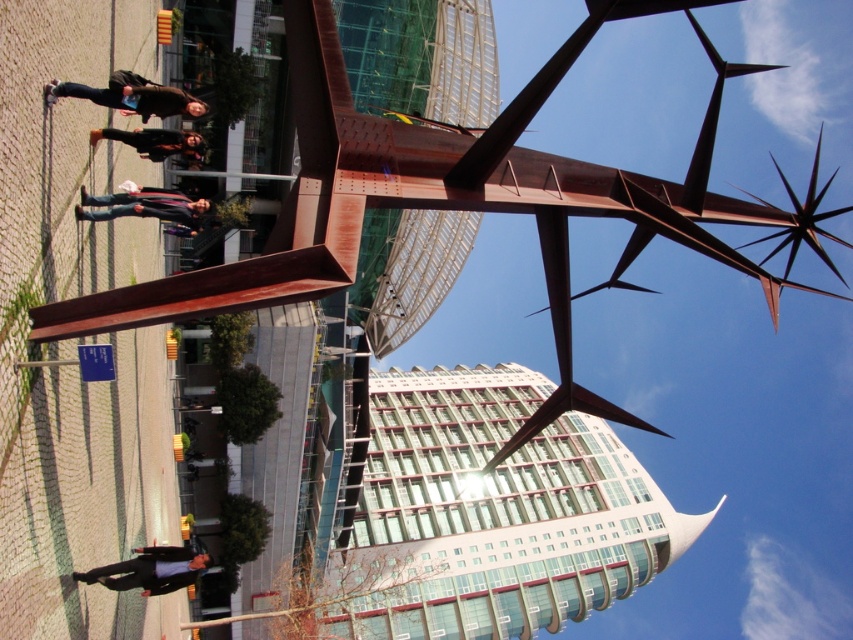
Question: Is dark blue suit at lower left above rusty metal sculpture at left?

Choices:
 (A) yes
 (B) no

Answer: (B)

Question: Which object appears closest to the camera in this image?

Choices:
 (A) rusty metal sculpture at left
 (B) matte brown jacket at center

Answer: (A)

Question: Which point is closer to the camera taking this photo?

Choices:
 (A) (131, 99)
 (B) (125, 193)
 (C) (178, 145)
 (D) (148, 580)

Answer: (D)

Question: Can you confirm if dark blue suit at lower left is positioned above matte brown jacket at center?

Choices:
 (A) yes
 (B) no

Answer: (B)

Question: Can you confirm if dark blue suit at lower left is positioned below matte brown jacket at center?

Choices:
 (A) no
 (B) yes

Answer: (B)

Question: Which object is the farthest from the rusty metal sculpture at left?

Choices:
 (A) dark brown leather jacket at upper left
 (B) matte brown jacket at center
 (C) dark blue suit at lower left

Answer: (C)